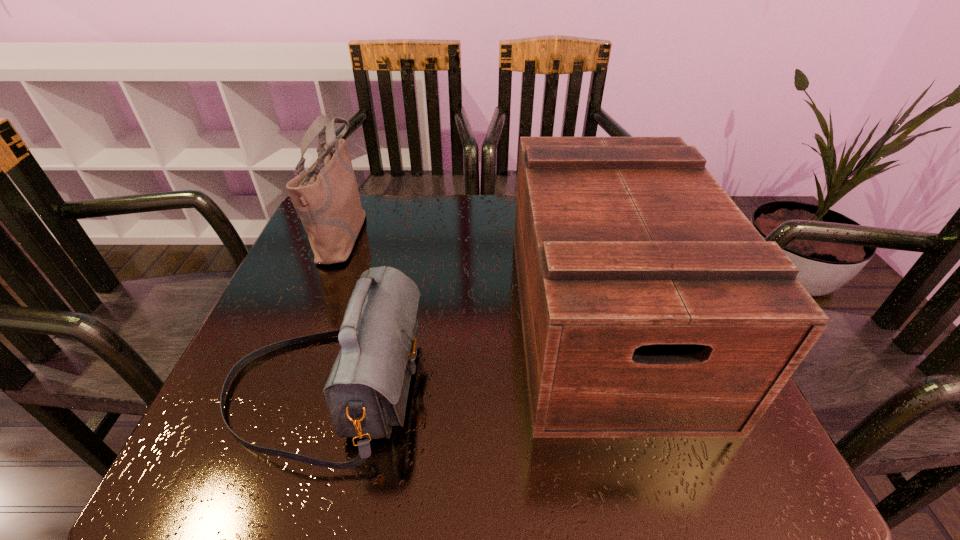
Find the location of a particular element. This screenshot has width=960, height=540. shoulder bag at the near edge is located at coordinates (366, 392).

You are a GUI agent. You are given a task and a screenshot of the screen. Output one action in this format:
    pyautogui.click(x=<x>, y=<y>)
    Task: Click on the object at the right edge
    The width and height of the screenshot is (960, 540).
    Given the screenshot: What is the action you would take?
    pyautogui.click(x=651, y=307)

Where is `object that is positioned at the far left corner`? The height and width of the screenshot is (540, 960). object that is positioned at the far left corner is located at coordinates (326, 197).

Image resolution: width=960 pixels, height=540 pixels. Identify the location of object that is at the near left corner. (366, 392).

Locate an element on the screen. The image size is (960, 540). object present at the far right corner is located at coordinates (651, 307).

At what (x,y) coordinates should I click in order to perform the action: click on object located at the near right corner. Please return your answer as a coordinate pair (x, y). This screenshot has width=960, height=540. Looking at the image, I should click on (651, 307).

This screenshot has height=540, width=960. I want to click on vacant region at the far edge, so click(x=470, y=243).

In the image, there is a desktop. Where is `free space at the near edge`? free space at the near edge is located at coordinates (419, 449).

Where is `vacant area at the left edge of the desktop`? This screenshot has width=960, height=540. vacant area at the left edge of the desktop is located at coordinates (297, 335).

This screenshot has height=540, width=960. I want to click on blank space at the far left corner of the desktop, so click(x=303, y=235).